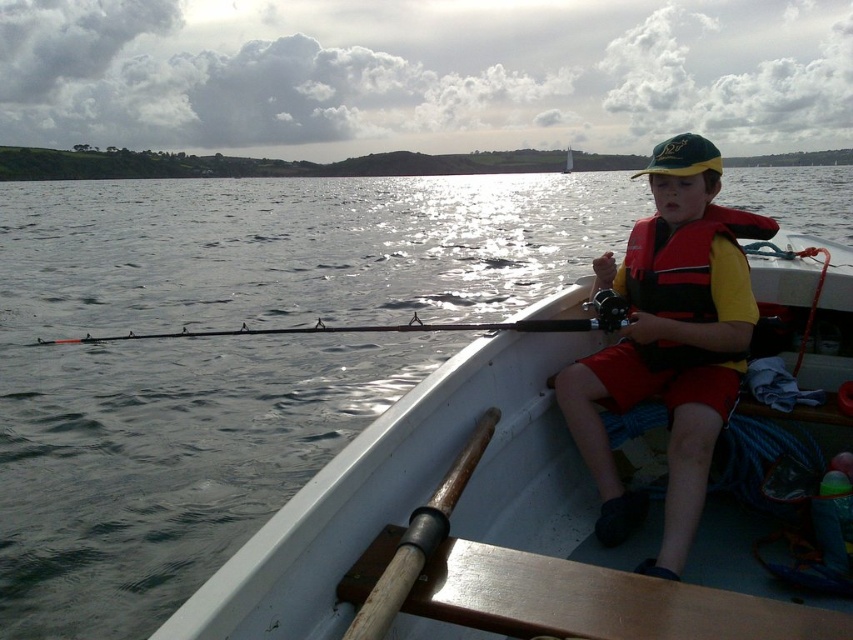
Is white plastic boat at center to the left of red nylon life jacket at center from the viewer's perspective?

Incorrect, white plastic boat at center is not on the left side of red nylon life jacket at center.

Can you confirm if white plastic boat at center is thinner than red nylon life jacket at center?

Incorrect, white plastic boat at center's width is not less than red nylon life jacket at center's.

The height and width of the screenshot is (640, 853). What are the coordinates of `white plastic boat at center` in the screenshot? It's located at (556, 499).

Is white plastic boat at center thinner than matte orange life vest at center?

No, white plastic boat at center is not thinner than matte orange life vest at center.

Does point (811, 376) come in front of point (688, 323)?

No.

Between point (802, 408) and point (663, 176), which one is positioned behind?

Point (663, 176)

Identify the location of white plastic boat at center. The width and height of the screenshot is (853, 640). (556, 499).

Who is higher up, matte orange life vest at center or red nylon life jacket at center?

Positioned higher is red nylon life jacket at center.

Who is more forward, (677, 218) or (704, 269)?

Point (704, 269) is more forward.

What are the coordinates of `matte orange life vest at center` in the screenshot? It's located at (670, 340).